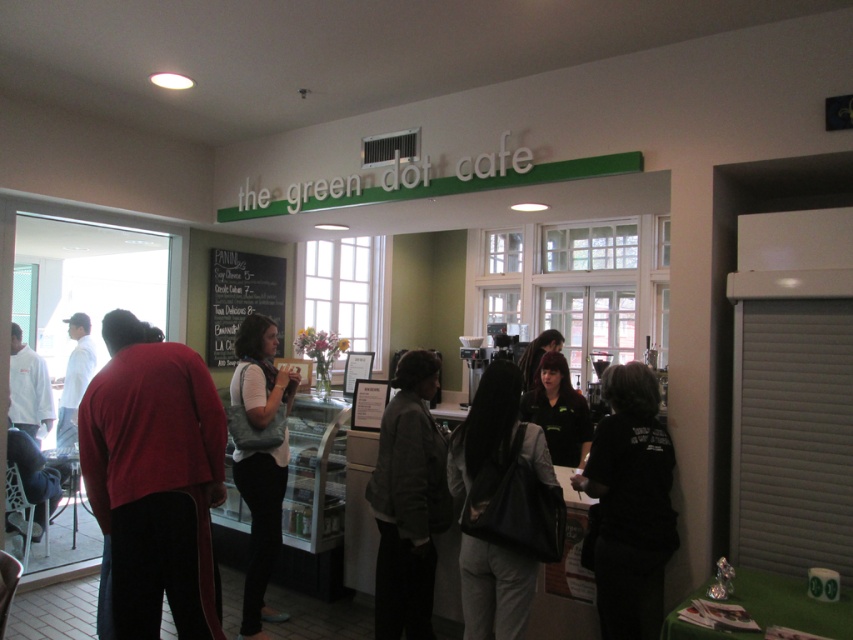
You are a customer at The Green Dot Cafe and want to place your gray fabric tote bag at center near the counter. The staff member in the black matte shirt at center is standing 40 centimeters away from you. Can you safely place your bag next to them without it being too far?

The distance between the black matte shirt at center and the gray fabric tote bag at center is approximately 40 centimeters. Since the staff member is 40 centimeters away from you, placing the bag next to them would mean the bag is about the same distance from you as the staff member, which is safe and within a reasonable proximity.